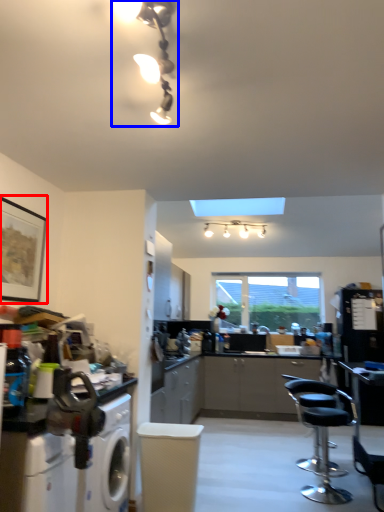
Question: Which object is closer to the camera taking this photo, picture frame (highlighted by a red box) or light fixture (highlighted by a blue box)?

Choices:
 (A) picture frame
 (B) light fixture

Answer: (B)